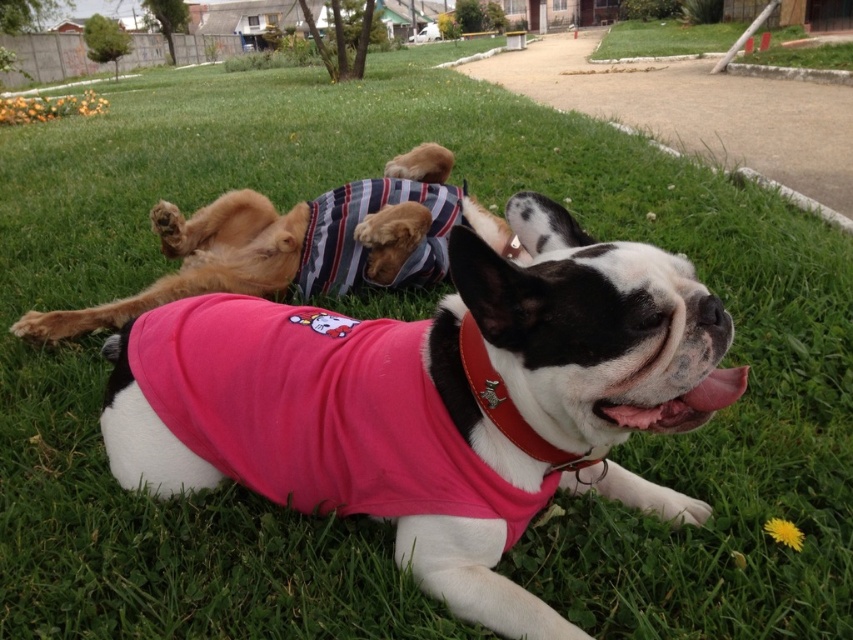
In the scene shown: Is striped fabric dog at upper center positioned behind red leather collar at center?

Yes, striped fabric dog at upper center is behind red leather collar at center.

Identify the location of striped fabric dog at upper center. The height and width of the screenshot is (640, 853). (199, 260).